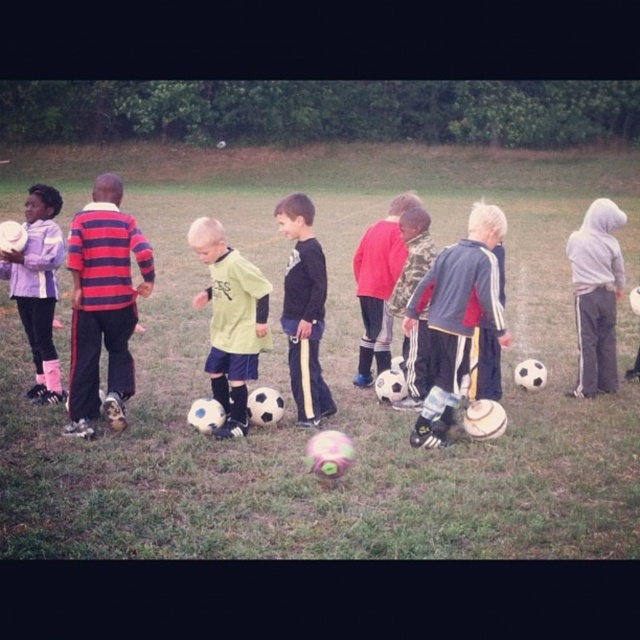
Between white matte soccer ball at center and matte purple jacket at left, which one is positioned lower?

Positioned lower is matte purple jacket at left.

Is point (516, 250) more distant than point (38, 196)?

Yes.

Identify the location of white matte soccer ball at center. The height and width of the screenshot is (640, 640). (196, 310).

Between white matte soccer ball at center and black matte shirt at center, which one is positioned lower?

black matte shirt at center is below.

Is white matte soccer ball at center below black matte shirt at center?

No.

Who is more forward, (19, 342) or (308, 330)?

Positioned in front is point (308, 330).

Identify the location of white matte soccer ball at center. (196, 310).

Can you confirm if white matte soccer ball at center is positioned below light green jersey at center?

No.

Find the location of a particular element. white matte soccer ball at center is located at coordinates (196, 310).

Where is `white matte soccer ball at center`? The width and height of the screenshot is (640, 640). white matte soccer ball at center is located at coordinates (196, 310).